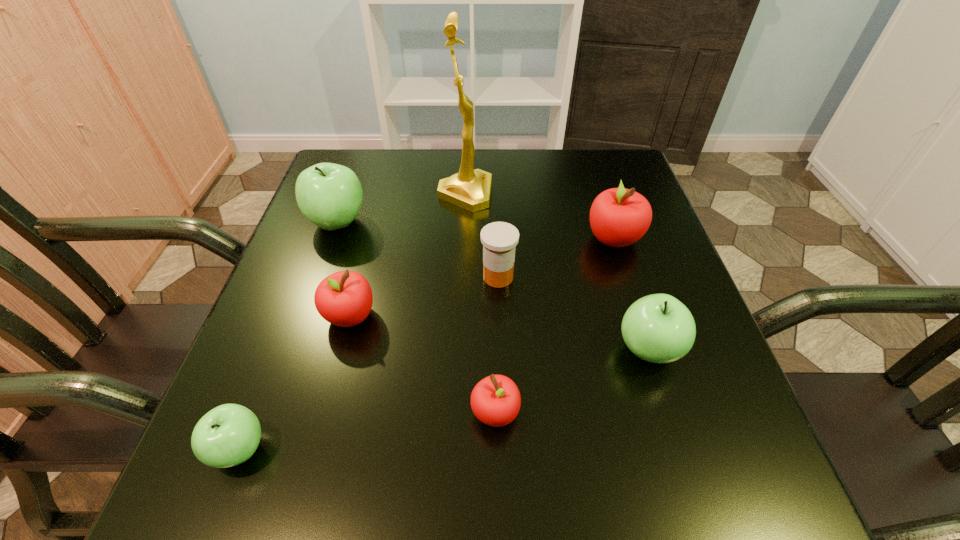
The height and width of the screenshot is (540, 960). I want to click on free point that satisfies the following two spatial constraints: 1. on the front-facing side of the third apple from right to left; 2. on the right side of the golden award, so click(457, 412).

Identify the location of vacant point that satisfies the following two spatial constraints: 1. on the front-facing side of the award; 2. on the right side of the third apple from right to left. point(457,412).

Locate an element on the screen. Image resolution: width=960 pixels, height=540 pixels. free point that satisfies the following two spatial constraints: 1. on the front-facing side of the nearest red apple; 2. on the right side of the golden award is located at coordinates (457, 412).

The image size is (960, 540). I want to click on free spot that satisfies the following two spatial constraints: 1. on the back side of the second biggest green apple; 2. on the front-facing side of the award, so click(599, 195).

I want to click on vacant region that satisfies the following two spatial constraints: 1. on the back side of the leftmost red apple; 2. on the right side of the farthest red apple, so click(x=371, y=238).

Where is `free space that satisfies the following two spatial constraints: 1. on the back side of the biggest green apple; 2. on the left side of the nearest green apple`? This screenshot has width=960, height=540. free space that satisfies the following two spatial constraints: 1. on the back side of the biggest green apple; 2. on the left side of the nearest green apple is located at coordinates (326, 222).